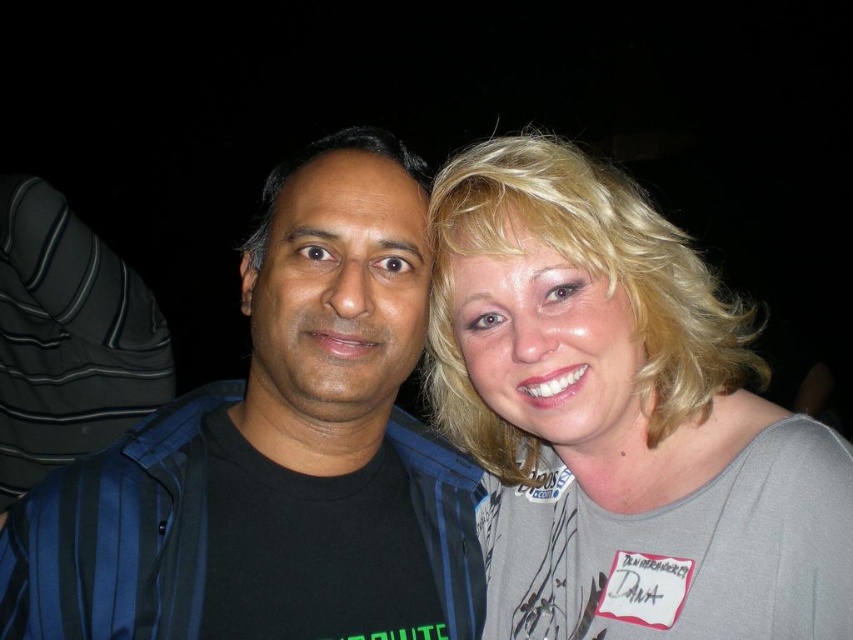
Does gray fabric shirt at upper right have a smaller size compared to black matte jacket at left?

Actually, gray fabric shirt at upper right might be larger than black matte jacket at left.

Who is higher up, gray fabric shirt at upper right or black matte jacket at left?

black matte jacket at left is above.

Is point (607, 538) less distant than point (451, 636)?

That is True.

The height and width of the screenshot is (640, 853). I want to click on gray fabric shirt at upper right, so click(619, 419).